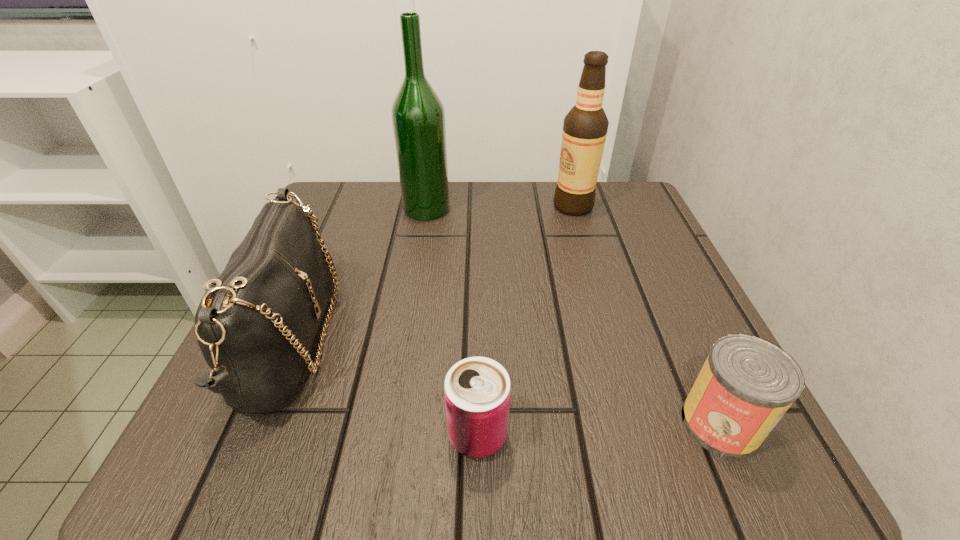
The image size is (960, 540). I want to click on free point located on the label of the right alcohol, so click(389, 206).

The height and width of the screenshot is (540, 960). In order to click on vacant space located on the label of the right alcohol in this screenshot , I will do `click(455, 206)`.

The height and width of the screenshot is (540, 960). Identify the location of vacant area situated at the front of the third tallest object with chain and zipper. (372, 341).

At what (x,y) coordinates should I click in order to perform the action: click on free space located 0.240m on the left of the right can. Please return your answer as a coordinate pair (x, y). This screenshot has width=960, height=540. Looking at the image, I should click on (503, 423).

Find the location of a particular element. The image size is (960, 540). vacant space located on the back of the third object from right to left is located at coordinates (478, 265).

The height and width of the screenshot is (540, 960). In order to click on handbag present at the near edge in this screenshot , I will do [x=255, y=325].

Identify the location of object present at the left edge. The width and height of the screenshot is (960, 540). (255, 325).

This screenshot has width=960, height=540. I want to click on alcohol at the right edge, so click(585, 127).

The image size is (960, 540). What are the coordinates of `can that is at the right edge` in the screenshot? It's located at (746, 385).

Locate an element on the screen. This screenshot has height=540, width=960. object that is at the near left corner is located at coordinates (255, 325).